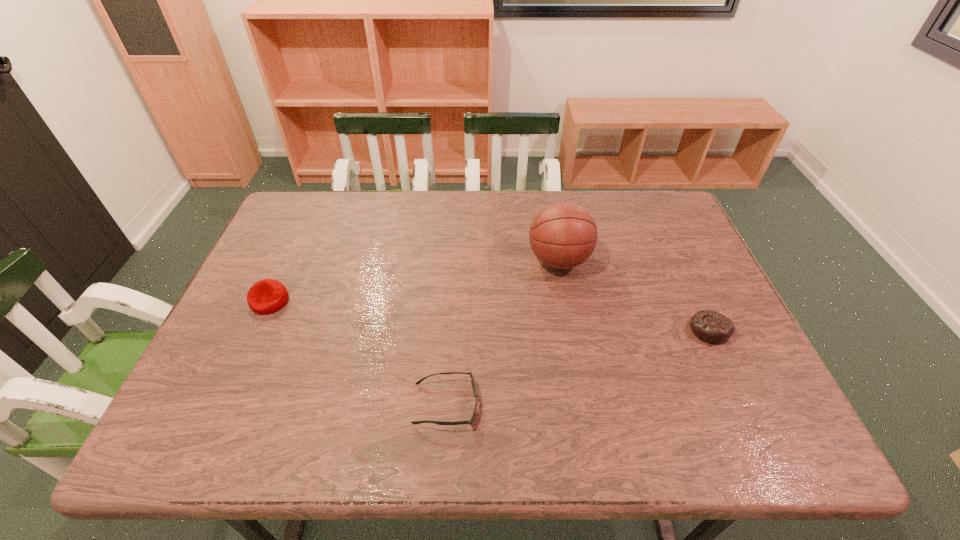
Where is `blank space at the far right corner of the desktop`? This screenshot has height=540, width=960. blank space at the far right corner of the desktop is located at coordinates (652, 213).

The width and height of the screenshot is (960, 540). What are the coordinates of `unoccupied area between the leftmost object and the right beanbag` in the screenshot? It's located at (490, 315).

This screenshot has height=540, width=960. Find the location of `vacant space in between the shortest object and the farthest object`. vacant space in between the shortest object and the farthest object is located at coordinates (502, 332).

You are a GUI agent. You are given a task and a screenshot of the screen. Output one action in this format:
    pyautogui.click(x=<x>, y=<y>)
    Task: Click on the free point between the rightmost object and the left beanbag
    
    Given the screenshot: What is the action you would take?
    pyautogui.click(x=490, y=315)

The width and height of the screenshot is (960, 540). Identify the location of vacant area that lies between the third object from left to right and the rightmost object. (635, 295).

This screenshot has width=960, height=540. I want to click on free area in between the leftmost object and the nearest object, so click(358, 353).

At what (x,y) coordinates should I click in order to perform the action: click on vacant area that lies between the third shortest object and the second shortest object. Please return your answer as a coordinate pair (x, y). The image size is (960, 540). Looking at the image, I should click on (490, 315).

Find the location of a particular element. This screenshot has width=960, height=540. vacant area that lies between the second shortest object and the tallest object is located at coordinates (635, 295).

Identify the location of unoccupied position between the sunglasses and the left beanbag. (358, 353).

You are a GUI agent. You are given a task and a screenshot of the screen. Output one action in this format:
    pyautogui.click(x=<x>, y=<y>)
    Task: Click on the vacant space that is in between the shorter beanbag and the farthest object
    
    Given the screenshot: What is the action you would take?
    pyautogui.click(x=635, y=295)